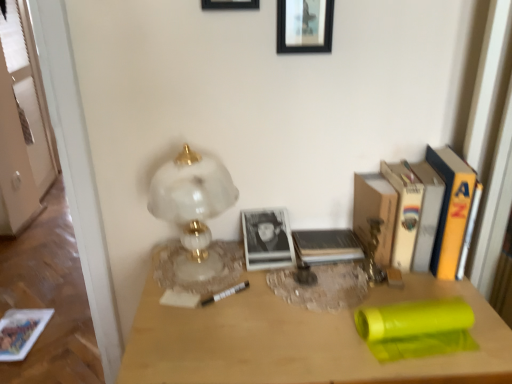
Describe the element at coordinates (426, 214) in the screenshot. I see `white paper at right, which appears as the 2th paperback book when viewed from the right` at that location.

What do you see at coordinates (229, 4) in the screenshot? Image resolution: width=512 pixels, height=384 pixels. I see `black matte picture frame at upper center, placed as the second picture frame when sorted from right to left` at bounding box center [229, 4].

This screenshot has height=384, width=512. I want to click on matte wood desk at center, so click(298, 340).

What do you see at coordinates (298, 340) in the screenshot? This screenshot has width=512, height=384. I see `matte wood desk at center` at bounding box center [298, 340].

What is the approximate width of hardcover book at center, which is the 5th paperback book in right-to-left order?

5.68 inches.

Locate an element on the screen. The height and width of the screenshot is (384, 512). hardcover book at right, acting as the 3th paperback book starting from the left is located at coordinates (404, 211).

Measure the distance from white paper at right, which appears as the 2th paperback book when viewed from the right, to white marble lamp at left.

white paper at right, which appears as the 2th paperback book when viewed from the right, and white marble lamp at left are 20.95 inches apart from each other.

You are a GUI agent. You are given a task and a screenshot of the screen. Output one action in this format:
    pyautogui.click(x=<x>, y=<y>)
    Task: Click on the lamp that is above the white paper at right, which appears as the 2th paperback book when viewed from the right (from the image's perspective)
    Image resolution: width=512 pixels, height=384 pixels.
    Given the screenshot: What is the action you would take?
    193,207

Considering the sizes of objects white paper at right, the fourth paperback book when ordered from left to right, and white marble lamp at left in the image provided, who is bigger, white paper at right, the fourth paperback book when ordered from left to right, or white marble lamp at left?

Bigger between the two is white marble lamp at left.

From the image's perspective, is white paper at right, the fourth paperback book when ordered from left to right, over white marble lamp at left?

Incorrect, from the image's perspective, white paper at right, the fourth paperback book when ordered from left to right, is lower than white marble lamp at left.

In the scene shown: Is the depth of yellow paper at right, positioned as the fifth paperback book in left-to-right order, less than that of hardcover book at center, positioned as the first paperback book in left-to-right order?

Yes, the depth of yellow paper at right, positioned as the fifth paperback book in left-to-right order, is less than that of hardcover book at center, positioned as the first paperback book in left-to-right order.

Is yellow paper at right, placed as the 1th paperback book when sorted from right to left, turned away from hardcover book at center, positioned as the first paperback book in left-to-right order?

No, yellow paper at right, placed as the 1th paperback book when sorted from right to left, is not facing away from hardcover book at center, positioned as the first paperback book in left-to-right order.

How distant is yellow paper at right, positioned as the fifth paperback book in left-to-right order, from hardcover book at center, which is the 5th paperback book in right-to-left order?

yellow paper at right, positioned as the fifth paperback book in left-to-right order, and hardcover book at center, which is the 5th paperback book in right-to-left order, are 25.70 centimeters apart from each other.

Where is `the 4th paperback book to the left of the yellow paper at right, positioned as the fifth paperback book in left-to-right order, starting your count from the anchor`? Image resolution: width=512 pixels, height=384 pixels. the 4th paperback book to the left of the yellow paper at right, positioned as the fifth paperback book in left-to-right order, starting your count from the anchor is located at coordinates (327, 245).

Is point (44, 320) closer or farther from the camera than point (229, 8)?

Point (44, 320) is positioned farther from the camera compared to point (229, 8).

Would you say matte paper book at lower left is to the left or to the right of black matte picture frame at upper center, placed as the second picture frame when sorted from right to left, in the picture?

Based on their positions, matte paper book at lower left is located to the left of black matte picture frame at upper center, placed as the second picture frame when sorted from right to left.

In the scene shown: What's the angular difference between matte paper book at lower left and black matte picture frame at upper center, placed as the second picture frame when sorted from right to left,'s facing directions?

They differ by 178 degrees in their facing directions.

Considering the sizes of objects matte paper book at lower left and black matte picture frame at upper center, placed as the second picture frame when sorted from right to left, in the image provided, who is bigger, matte paper book at lower left or black matte picture frame at upper center, placed as the second picture frame when sorted from right to left,?

With larger size is matte paper book at lower left.

Is point (256, 9) closer to viewer compared to point (443, 165)?

That is True.

At what (x,y) coordinates should I click in order to perform the action: click on the 2nd picture frame located above the yellow paper at right, placed as the 1th paperback book when sorted from right to left (from a real-world perspective). Please return your answer as a coordinate pair (x, y). The width and height of the screenshot is (512, 384). Looking at the image, I should click on (229, 4).

In the image, is black matte picture frame at upper center, placed as the second picture frame when sorted from right to left, on the left side or the right side of yellow paper at right, positioned as the fifth paperback book in left-to-right order?

From the image, it's evident that black matte picture frame at upper center, placed as the second picture frame when sorted from right to left, is to the left of yellow paper at right, positioned as the fifth paperback book in left-to-right order.

Are matte cardboard book at center-right, marked as the fourth paperback book in a right-to-left arrangement, and black matte picture frame at upper center, which appears as the first picture frame when viewed from the left, located far from each other?

They are positioned close to each other.

Where is `the 2nd picture frame located above the matte cardboard book at center-right, positioned as the 2th paperback book in left-to-right order (from a real-world perspective)`? The image size is (512, 384). the 2nd picture frame located above the matte cardboard book at center-right, positioned as the 2th paperback book in left-to-right order (from a real-world perspective) is located at coordinates (229, 4).

From the image's perspective, would you say matte cardboard book at center-right, marked as the fourth paperback book in a right-to-left arrangement, is positioned over black matte picture frame at upper center, which appears as the first picture frame when viewed from the left?

No.

Which object is wider, matte cardboard book at center-right, marked as the fourth paperback book in a right-to-left arrangement, or black matte picture frame at upper center, placed as the second picture frame when sorted from right to left?

Wider between the two is matte cardboard book at center-right, marked as the fourth paperback book in a right-to-left arrangement.

Is matte paper book at lower left next to hardcover book at center, which is the 5th paperback book in right-to-left order, and touching it?

No, matte paper book at lower left is not in contact with hardcover book at center, which is the 5th paperback book in right-to-left order.

Is point (28, 309) positioned behind point (338, 259)?

Yes.

From a real-world perspective, relative to hardcover book at center, which is the 5th paperback book in right-to-left order, is matte paper book at lower left vertically above or below?

From a real-world perspective, matte paper book at lower left is physically below hardcover book at center, which is the 5th paperback book in right-to-left order.

Which object is positioned more to the right, matte paper book at lower left or hardcover book at center, which is the 5th paperback book in right-to-left order?

hardcover book at center, which is the 5th paperback book in right-to-left order.

From a real-world perspective, does hardcover book at center, which is the 5th paperback book in right-to-left order, stand above black matte picture frame at upper center, which is the 2th picture frame in left-to-right order?

No.

Does hardcover book at center, positioned as the first paperback book in left-to-right order, have a lesser height compared to black matte picture frame at upper center, which is the 2th picture frame in left-to-right order?

Yes.

Is hardcover book at center, positioned as the first paperback book in left-to-right order, in contact with black matte picture frame at upper center, which is the 2th picture frame in left-to-right order?

hardcover book at center, positioned as the first paperback book in left-to-right order, and black matte picture frame at upper center, which is the 2th picture frame in left-to-right order, are clearly separated.

Identify the location of the 4th paperback book to the right of the white marble lamp at left, starting your count from the anchor. click(x=426, y=214).

Where is `the 4th paperback book directly beneath the yellow paper at right, placed as the 1th paperback book when sorted from right to left (from a real-world perspective)`? the 4th paperback book directly beneath the yellow paper at right, placed as the 1th paperback book when sorted from right to left (from a real-world perspective) is located at coordinates (327, 245).

Considering their positions, is hardcover book at center, positioned as the first paperback book in left-to-right order, positioned further to black matte picture frame at upper center, which is the 2th picture frame in left-to-right order, than white marble lamp at left?

The object further to black matte picture frame at upper center, which is the 2th picture frame in left-to-right order, is hardcover book at center, positioned as the first paperback book in left-to-right order.

Looking at the image, which one is located further to yellow paper at right, positioned as the fifth paperback book in left-to-right order, black matte picture frame at upper center, which ranks as the 1th picture frame in right-to-left order, or white marble lamp at left?

The object further to yellow paper at right, positioned as the fifth paperback book in left-to-right order, is white marble lamp at left.

When comparing their distances from matte wood desk at center, does yellow paper at right, placed as the 1th paperback book when sorted from right to left, or hardcover book at center, positioned as the first paperback book in left-to-right order, seem further?

Based on the image, yellow paper at right, placed as the 1th paperback book when sorted from right to left, appears to be further to matte wood desk at center.

From the image, which object appears to be nearer to matte paper book at lower left, matte cardboard book at center-right, marked as the fourth paperback book in a right-to-left arrangement, or hardcover book at right, acting as the 3th paperback book starting from the left?

The object closer to matte paper book at lower left is matte cardboard book at center-right, marked as the fourth paperback book in a right-to-left arrangement.

From the image, which object appears to be nearer to matte paper book at lower left, matte wood desk at center or yellow paper at right, positioned as the fifth paperback book in left-to-right order?

The object closer to matte paper book at lower left is matte wood desk at center.

Looking at the image, which one is located closer to hardcover book at right, acting as the 3th paperback book starting from the left, matte paper book at lower left or matte wood desk at center?

The object closer to hardcover book at right, acting as the 3th paperback book starting from the left, is matte wood desk at center.

Estimate the real-world distances between objects in this image. Which object is further from matte paper book at lower left, matte cardboard book at center-right, marked as the fourth paperback book in a right-to-left arrangement, or matte wood desk at center?

Based on the image, matte cardboard book at center-right, marked as the fourth paperback book in a right-to-left arrangement, appears to be further to matte paper book at lower left.

Based on their spatial positions, is yellow paper at right, positioned as the fifth paperback book in left-to-right order, or matte paper book at lower left further from hardcover book at right, acting as the 3th paperback book starting from the left?

matte paper book at lower left.

Where is `picture frame between black matte picture frame at upper center, placed as the second picture frame when sorted from right to left, and hardcover book at center, positioned as the first paperback book in left-to-right order, in the vertical direction`? This screenshot has height=384, width=512. picture frame between black matte picture frame at upper center, placed as the second picture frame when sorted from right to left, and hardcover book at center, positioned as the first paperback book in left-to-right order, in the vertical direction is located at coordinates (304, 26).

Locate an element on the screen. Image resolution: width=512 pixels, height=384 pixels. paperback book between matte cardboard book at center-right, positioned as the 2th paperback book in left-to-right order, and white paper at right, which appears as the 2th paperback book when viewed from the right, in the horizontal direction is located at coordinates (404, 211).

Find the location of a particular element. The height and width of the screenshot is (384, 512). paperback book between black matte picture frame at upper center, which is the 2th picture frame in left-to-right order, and hardcover book at right, acting as the 3th paperback book starting from the left, vertically is located at coordinates click(426, 214).

The height and width of the screenshot is (384, 512). I want to click on picture frame between black matte picture frame at upper center, which appears as the first picture frame when viewed from the left, and hardcover book at right, acting as the 3th paperback book starting from the left, in the up-down direction, so (x=304, y=26).